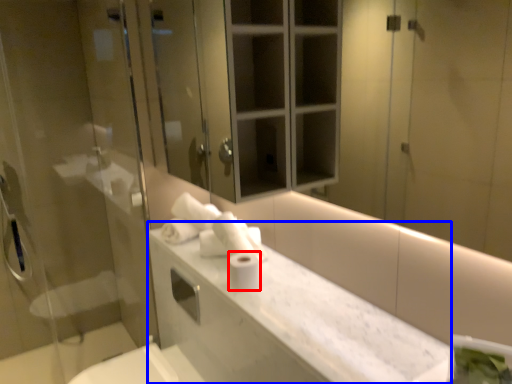
Question: Which point is closer to the camera, toilet paper (highlighted by a red box) or counter top (highlighted by a blue box)?

Choices:
 (A) toilet paper
 (B) counter top

Answer: (B)